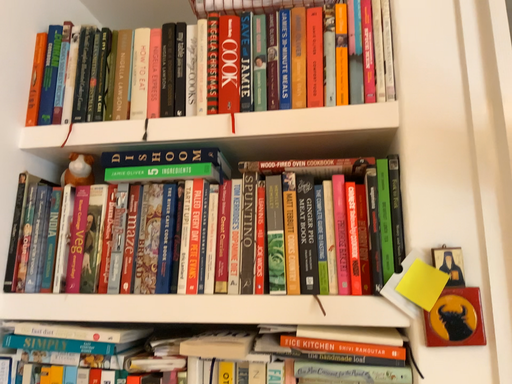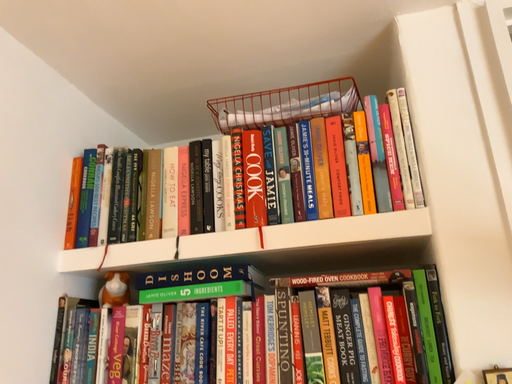
Question: Which way did the camera rotate in the video?

Choices:
 (A) rotated upward
 (B) rotated downward

Answer: (A)